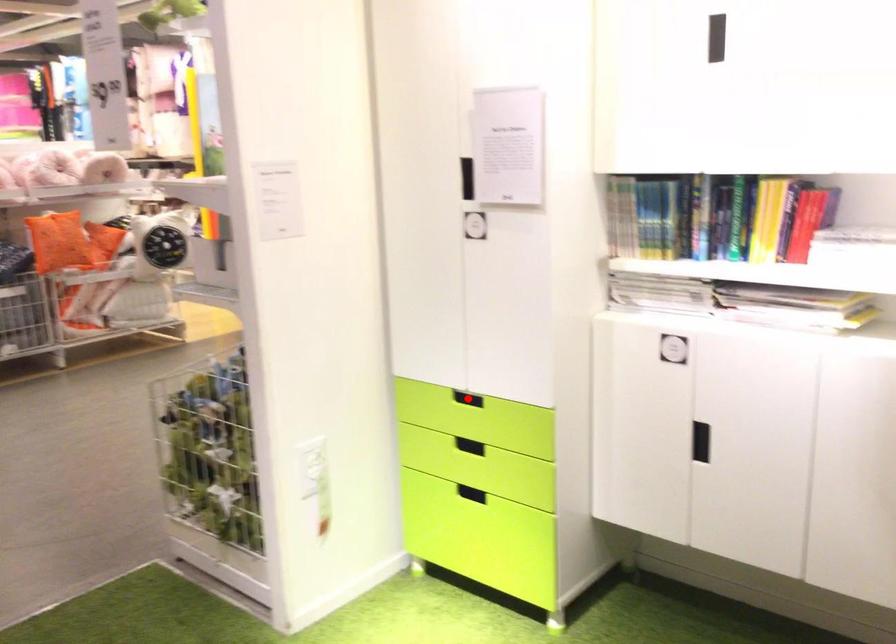
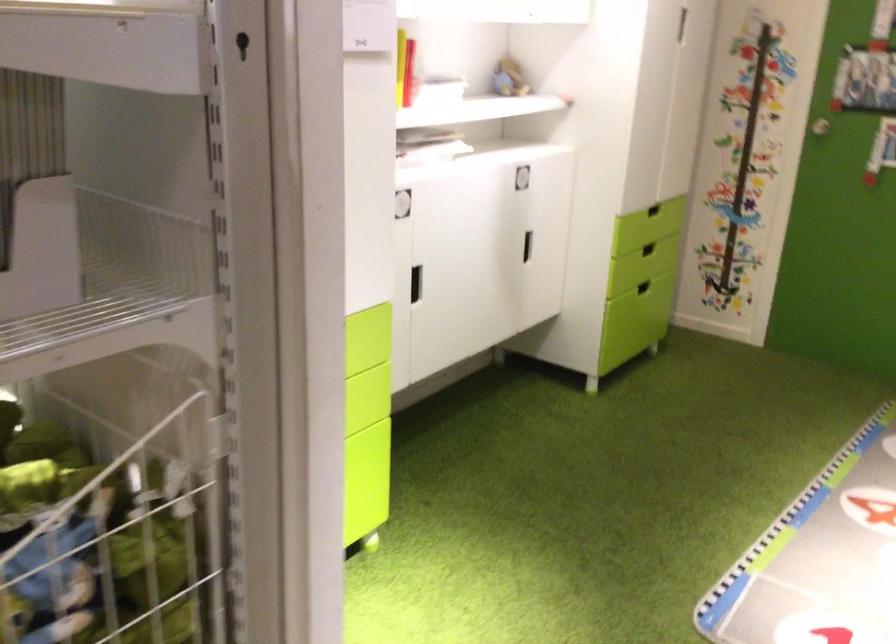
Question: I am providing you with two images of the same scene from different viewpoints. A red point is marked on the first image. Can you still see the location of the red point in image 2?

Choices:
 (A) Yes
 (B) No

Answer: (B)